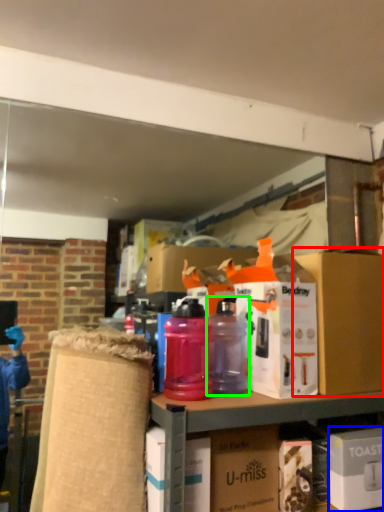
Question: Considering the real-world distances, which object is farthest from box (highlighted by a red box)? box (highlighted by a blue box) or bottle (highlighted by a green box)?

Choices:
 (A) box
 (B) bottle

Answer: (B)